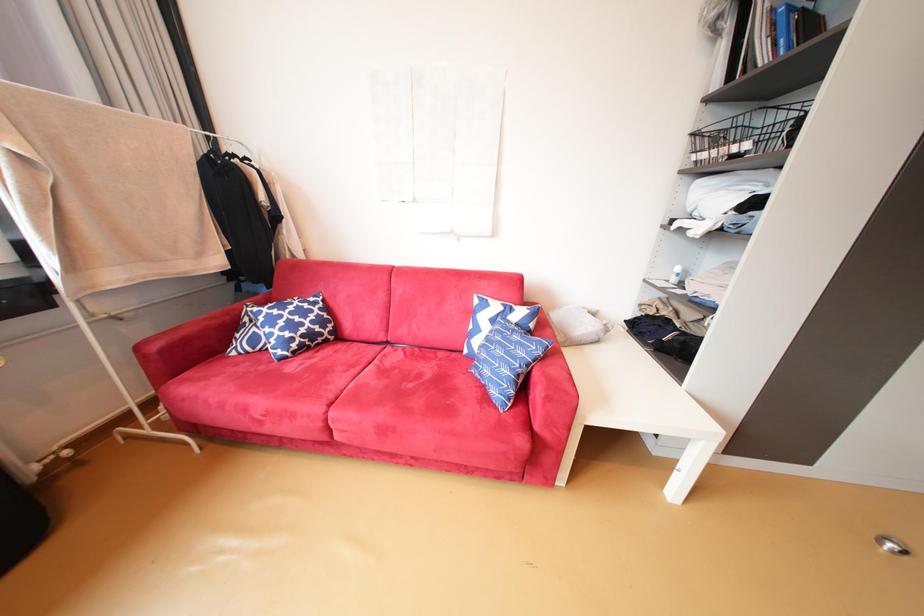
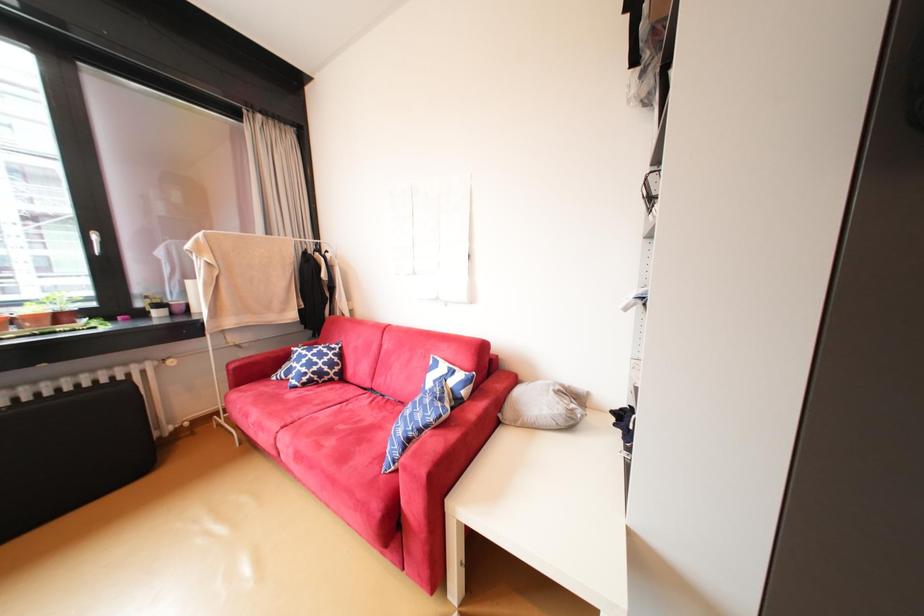
Question: The camera is either moving clockwise (left) or counter-clockwise (right) around the object. The first image is from the beginning of the video and the second image is from the end. Is the camera moving left or right when shooting the video?

Choices:
 (A) Left
 (B) Right

Answer: (B)